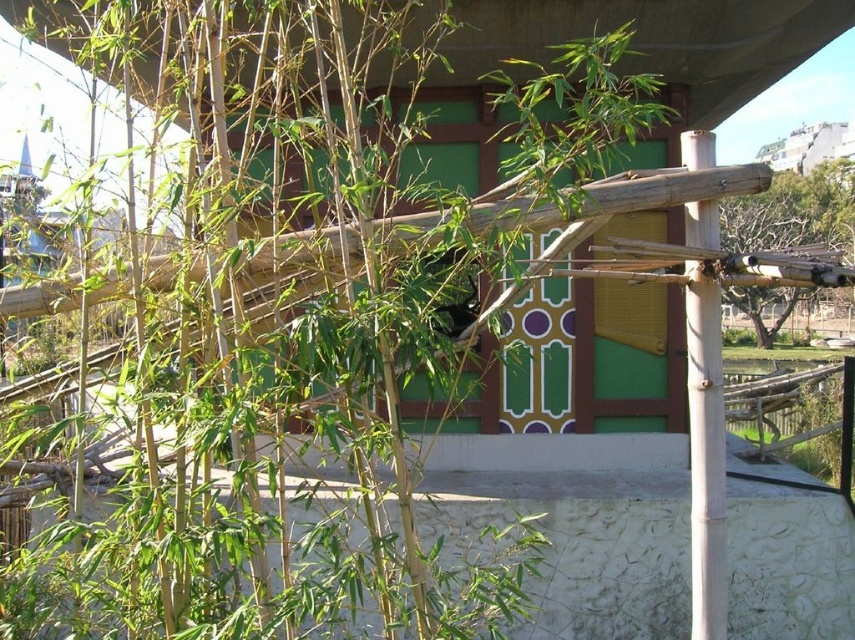
Is smooth bamboo pole at right bigger than bare wood structure at right?

Actually, smooth bamboo pole at right might be smaller than bare wood structure at right.

Is smooth bamboo pole at right wider than bare wood structure at right?

In fact, smooth bamboo pole at right might be narrower than bare wood structure at right.

Is point (700, 564) in front of point (852, 176)?

That is True.

Identify the location of smooth bamboo pole at right. The image size is (855, 640). (705, 454).